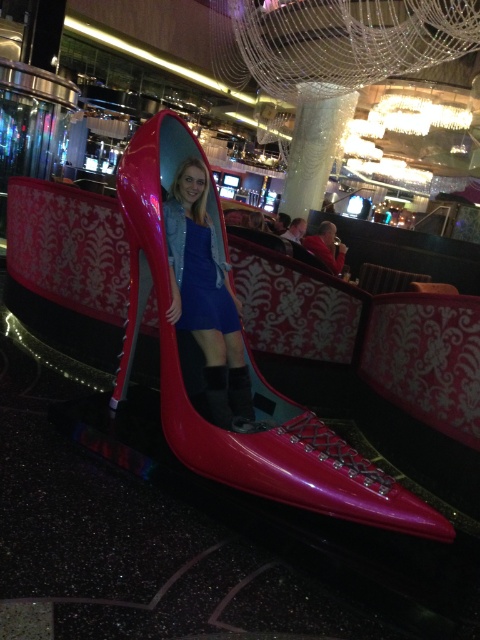
You are a photographer setting up a shoot in this space. You need to ensure that the matte blue dress at center is visible above the shiny patent leather shoe at center in your composition. Based on their sizes, is this possible?

The matte blue dress at center has a greater height compared to the shiny patent leather shoe at center, so yes, it is possible to position the matte blue dress at center so that it appears above the shiny patent leather shoe at center in the composition.

You are a photographer trying to capture the best angle of the scene. You notice the matte blue dress at center and the shiny patent leather shoe at center. Which object should you focus on first if you want to ensure the dress is in the foreground of your photo?

The matte blue dress at center is located above the shiny patent leather shoe at center, so focusing on the dress first will ensure it appears in the foreground of your photo.

Looking at this image, you are a fashion designer observing a unique installation. You notice the matte blue dress at center and the shiny patent leather shoe at center. Which object has a greater width?

The matte blue dress at center has a greater width than the shiny patent leather shoe at center.